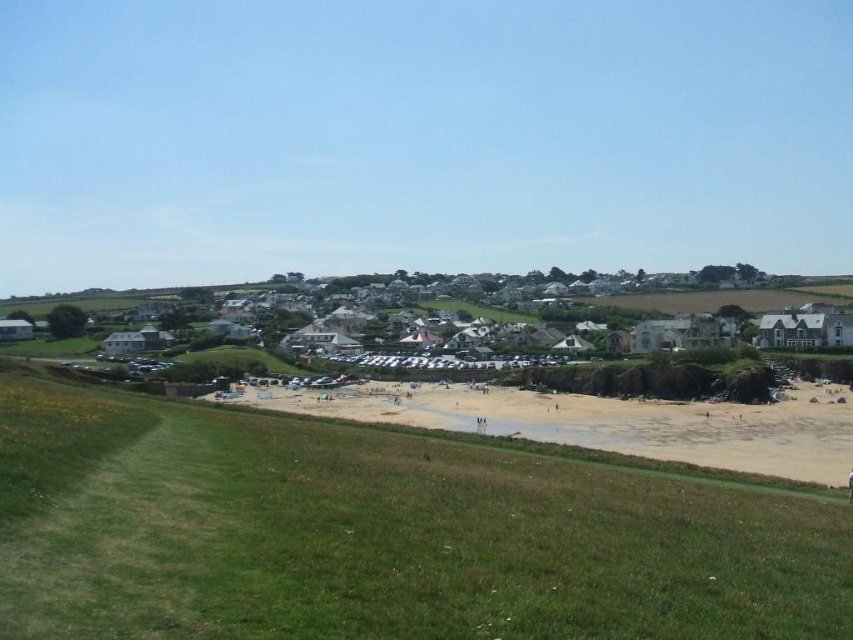
Question: Observing the image, what is the correct spatial positioning of green grassy field at lower center in reference to light brown sand at lower center?

Choices:
 (A) below
 (B) above

Answer: (B)

Question: Among these objects, which one is nearest to the camera?

Choices:
 (A) green grassy field at lower center
 (B) light brown sand at lower center

Answer: (A)

Question: Among these objects, which one is farthest from the camera?

Choices:
 (A) light brown sand at lower center
 (B) green grassy field at lower center

Answer: (A)

Question: Does green grassy field at lower center come behind light brown sand at lower center?

Choices:
 (A) no
 (B) yes

Answer: (A)

Question: Does green grassy field at lower center appear under light brown sand at lower center?

Choices:
 (A) no
 (B) yes

Answer: (A)